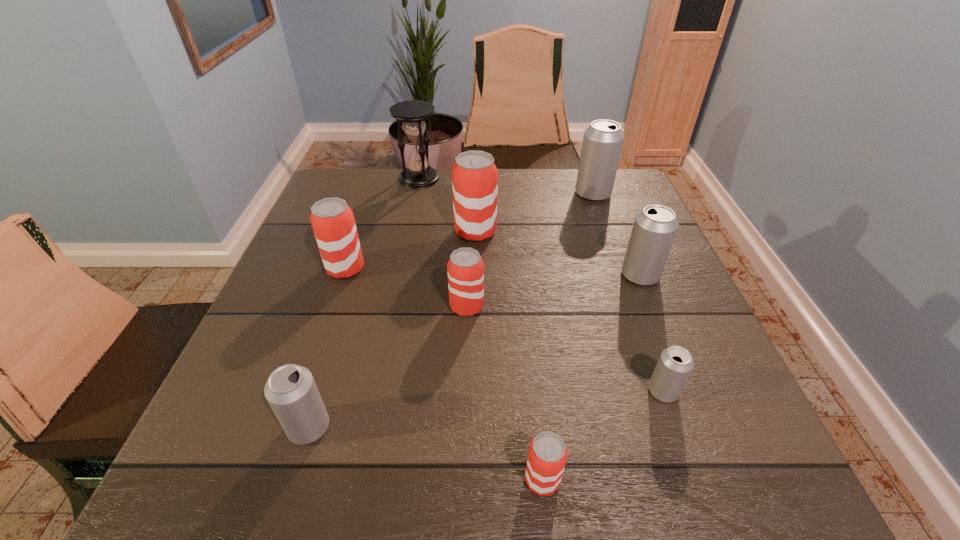
At what (x,y) coordinates should I click in order to perform the action: click on the fourth nearest beer can. Please return your answer as a coordinate pair (x, y). Looking at the image, I should click on (465, 269).

In order to click on the second nearest beer can in this screenshot , I will do `click(290, 390)`.

Where is `the leftmost white beer can`? The width and height of the screenshot is (960, 540). the leftmost white beer can is located at coordinates (290, 390).

Find the location of a particular element. the seventh farthest object is located at coordinates (675, 364).

What are the coordinates of `the third nearest beer can` in the screenshot? It's located at (675, 364).

Find the location of a particular element. the nearest orange beer can is located at coordinates (547, 455).

In order to click on the smallest orange beer can in this screenshot , I will do `click(547, 455)`.

Find the location of a particular element. vacant space located 0.200m on the right of the third object from left to right is located at coordinates (508, 179).

Find the location of a particular element. The width and height of the screenshot is (960, 540). blank space located 0.330m on the left of the farthest white beer can is located at coordinates (457, 193).

Image resolution: width=960 pixels, height=540 pixels. Identify the location of vacant area situated 0.090m on the right of the seventh nearest beer can. (533, 232).